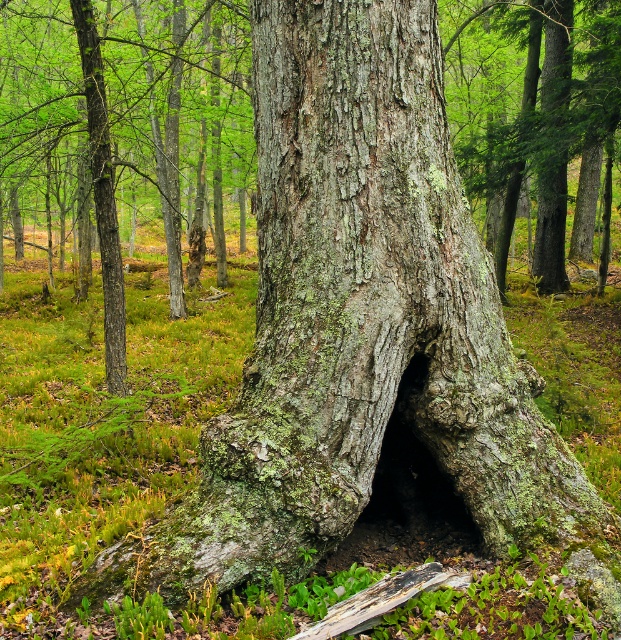
You are a hiker who wants to take a photo of the green mossy bark tree at center and the green mossy tree trunk at center. Since you have a wide angle lens, can you capture both in the same frame without moving your camera?

The green mossy bark tree at center is in front of the green mossy tree trunk at center, so you can capture both in the same frame without moving your camera because they are aligned along the same line of sight.

You are a hiker exploring the forest and notice a point marked at coordinates (176, 125). What object is located at this point?

The point at coordinates (176, 125) indicates the green mossy bark tree at center.

You are a hiker who wants to cross the forest floor. You see the green mossy tree trunk at center and the green mossy log at center. Which one is higher up from the ground?

The green mossy tree trunk at center is located above the green mossy log at center, so the green mossy tree trunk at center is higher up from the ground.